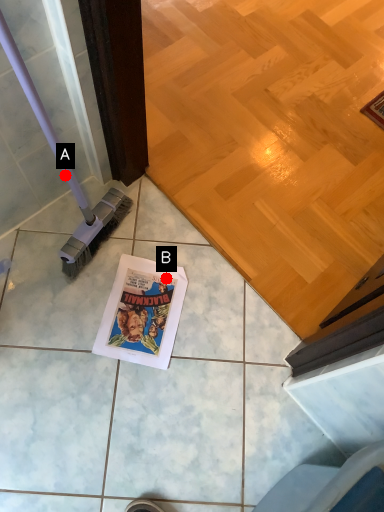
Question: Two points are circled on the image, labeled by A and B beside each circle. Among these points, which one is farthest from the camera?

Choices:
 (A) A is further
 (B) B is further

Answer: (B)